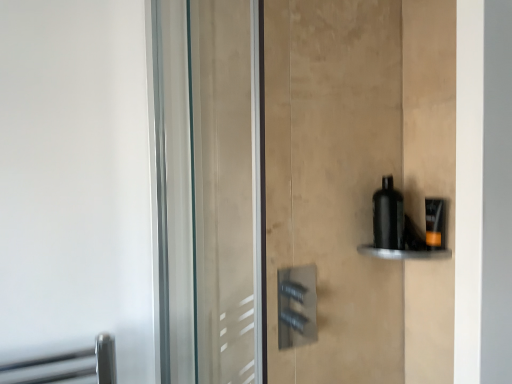
Question: Can you confirm if matte black bottle at right is wider than black matte bottle at right?

Choices:
 (A) no
 (B) yes

Answer: (A)

Question: From a real-world perspective, does matte black bottle at right sit lower than black matte bottle at right?

Choices:
 (A) no
 (B) yes

Answer: (B)

Question: Is matte black bottle at right positioned with its back to black matte bottle at right?

Choices:
 (A) no
 (B) yes

Answer: (A)

Question: From the image's perspective, does matte black bottle at right appear higher than black matte bottle at right?

Choices:
 (A) yes
 (B) no

Answer: (B)

Question: Considering the relative positions of matte black bottle at right and black matte bottle at right in the image provided, is matte black bottle at right to the left of black matte bottle at right from the viewer's perspective?

Choices:
 (A) no
 (B) yes

Answer: (A)

Question: Does matte black bottle at right have a lesser width compared to black matte bottle at right?

Choices:
 (A) no
 (B) yes

Answer: (B)

Question: Is black matte bottle at right in contact with black glossy bottle at right?

Choices:
 (A) yes
 (B) no

Answer: (A)

Question: Is black matte bottle at right outside black glossy bottle at right?

Choices:
 (A) yes
 (B) no

Answer: (A)

Question: Can you confirm if black matte bottle at right is bigger than black glossy bottle at right?

Choices:
 (A) yes
 (B) no

Answer: (A)

Question: Is black matte bottle at right closer to camera compared to black glossy bottle at right?

Choices:
 (A) no
 (B) yes

Answer: (A)

Question: Is black matte bottle at right positioned behind black glossy bottle at right?

Choices:
 (A) yes
 (B) no

Answer: (A)

Question: Can you confirm if black matte bottle at right is positioned to the right of black glossy bottle at right?

Choices:
 (A) yes
 (B) no

Answer: (B)

Question: Is black matte bottle at right surrounded by black glossy bottle at right?

Choices:
 (A) no
 (B) yes

Answer: (A)